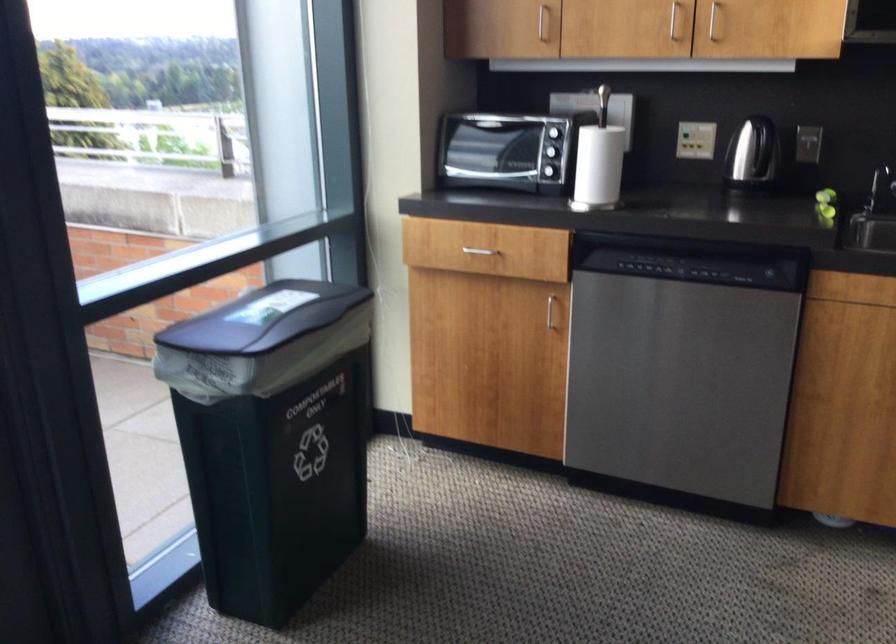
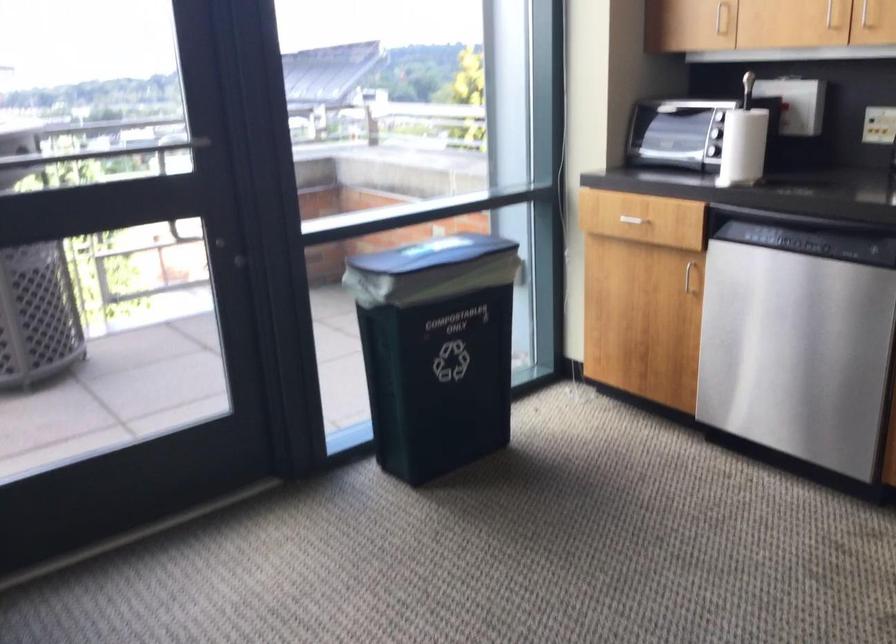
In the second image, find the point that corresponds to (472,247) in the first image.

(633, 214)